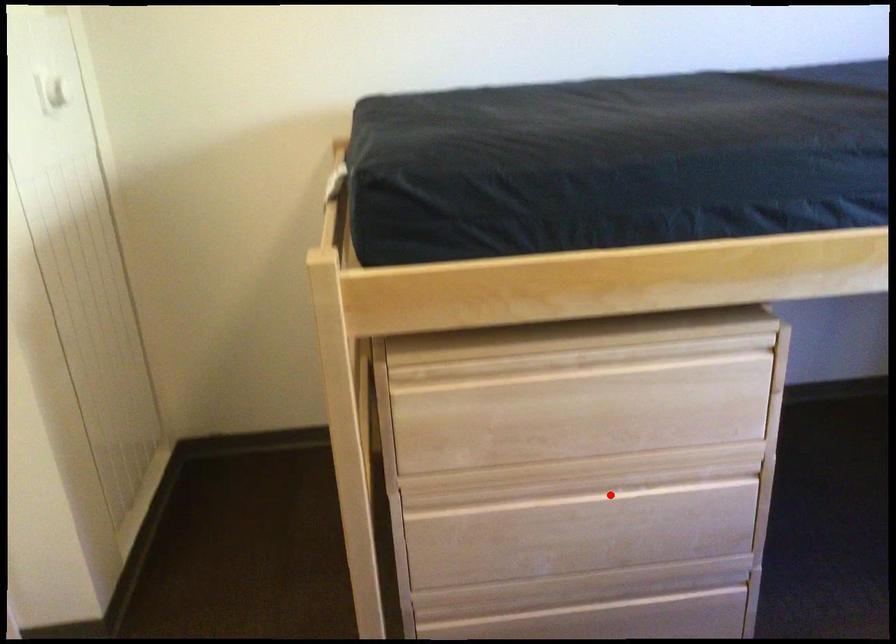
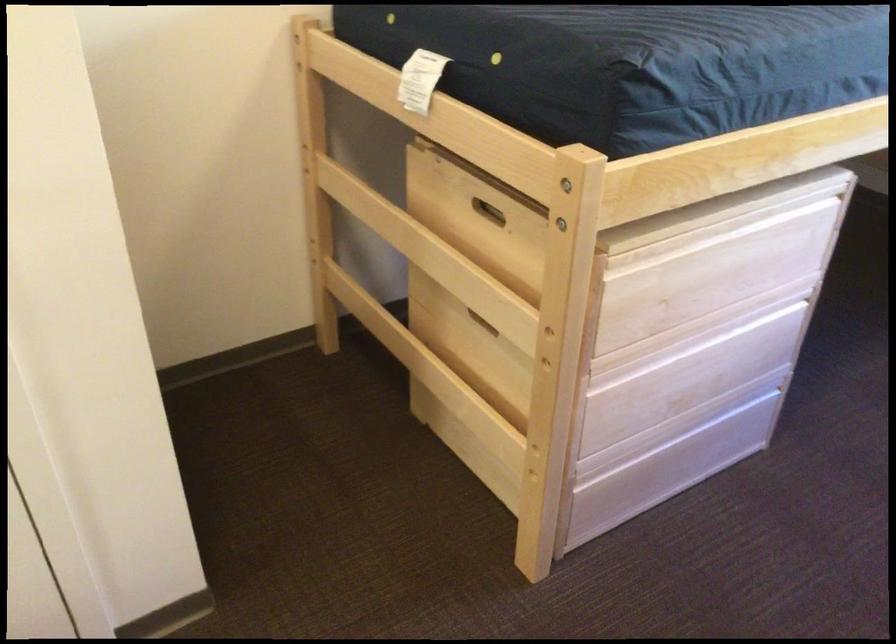
The point at the highlighted location is marked in the first image. Where is the corresponding point in the second image?

(718, 342)